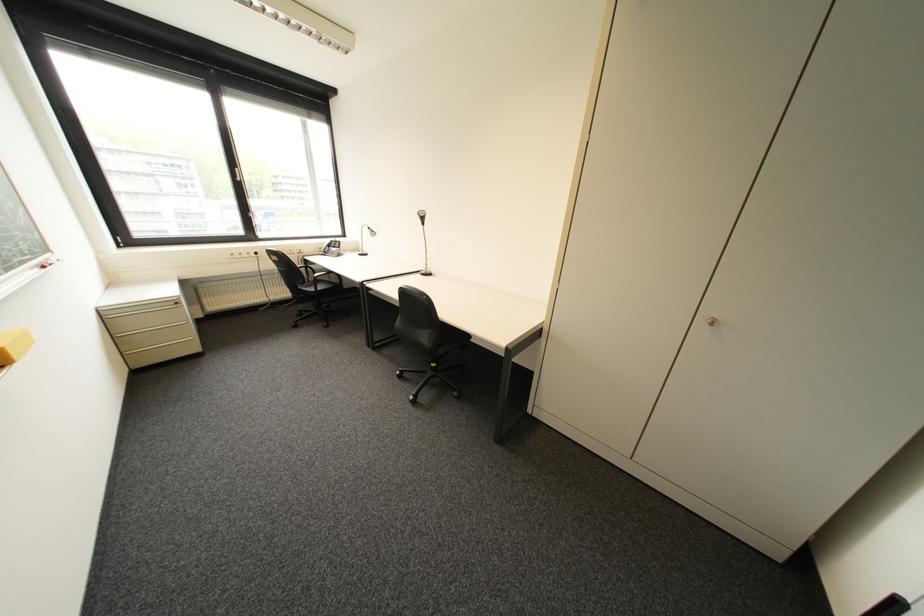
At what (x,y) coordinates should I click in order to perform the action: click on window handle. Please return your answer as a coordinate pair (x, y). Image resolution: width=924 pixels, height=616 pixels. Looking at the image, I should click on (238, 171).